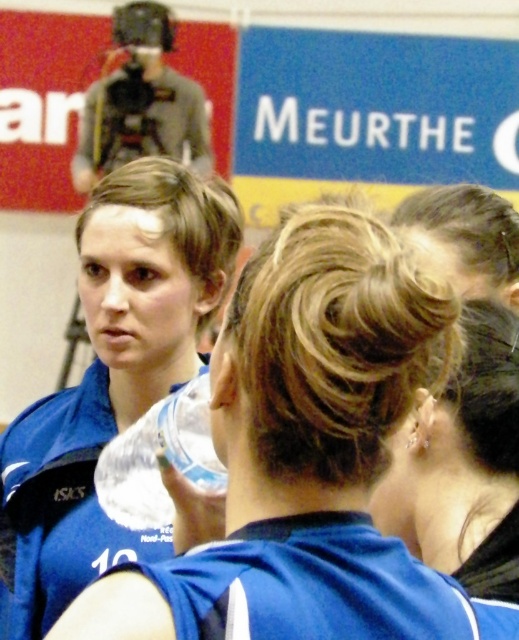
Is satin blue hair bun at center further to camera compared to blue fabric uniform at center?

No, satin blue hair bun at center is closer to the viewer.

How far apart are satin blue hair bun at center and blue fabric uniform at center?

satin blue hair bun at center and blue fabric uniform at center are 1.30 meters apart.

Who is more forward, (389,486) or (88,385)?

Point (389,486) is in front.

Identify the location of satin blue hair bun at center. (465, 472).

Which is more to the left, blue jersey at center or satin blue hair bun at center?

blue jersey at center is more to the left.

Does blue jersey at center come behind satin blue hair bun at center?

That is False.

Image resolution: width=519 pixels, height=640 pixels. Describe the element at coordinates (336, 584) in the screenshot. I see `blue jersey at center` at that location.

In order to click on blue jersey at center in this screenshot , I will do `click(336, 584)`.

Is point (105, 538) positioned after point (139, 508)?

Yes, point (105, 538) is farther from viewer.

Who is more forward, (34, 618) or (155, 436)?

Positioned in front is point (155, 436).

The image size is (519, 640). What are the coordinates of `blue fabric uniform at center` in the screenshot? It's located at (59, 508).